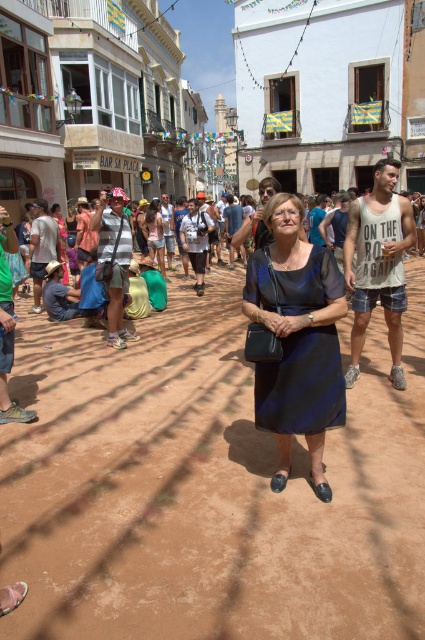
You are a fashion designer observing two dresses displayed in a Mediterranean street scene. The dresses are navy satin dress at center and matte black dress at center. Which dress is positioned to the right of the other?

The navy satin dress at center is to the right of the matte black dress at center.

Consider the image. You are a photographer trying to capture both the navy satin dress at center and the matte black dress at center in a single frame. Given their sizes, which dress might require you to adjust your camera angle to ensure it fits entirely in the photo?

The navy satin dress at center has a larger width than the matte black dress at center, so you might need to adjust your camera angle to accommodate its wider size to ensure it fits entirely in the photo.